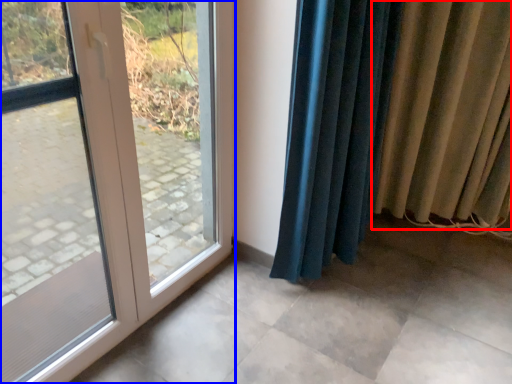
Question: Which of the following is the closest to the observer, curtain (highlighted by a red box) or door (highlighted by a blue box)?

Choices:
 (A) curtain
 (B) door

Answer: (B)